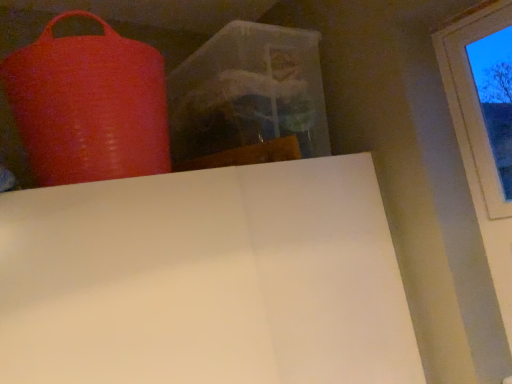
Question: From a real-world perspective, is rubberized red punching bag at upper left located higher than transparent glass window at upper right?

Choices:
 (A) yes
 (B) no

Answer: (A)

Question: Considering the relative sizes of rubberized red punching bag at upper left and transparent glass window at upper right in the image provided, is rubberized red punching bag at upper left smaller than transparent glass window at upper right?

Choices:
 (A) yes
 (B) no

Answer: (B)

Question: Is rubberized red punching bag at upper left facing towards transparent glass window at upper right?

Choices:
 (A) no
 (B) yes

Answer: (A)

Question: Does rubberized red punching bag at upper left have a greater width compared to transparent glass window at upper right?

Choices:
 (A) yes
 (B) no

Answer: (A)

Question: Is rubberized red punching bag at upper left directly adjacent to transparent glass window at upper right?

Choices:
 (A) no
 (B) yes

Answer: (A)

Question: From a real-world perspective, is rubberized red punching bag at upper left physically below transparent glass window at upper right?

Choices:
 (A) yes
 (B) no

Answer: (B)

Question: Does transparent glass window at upper right have a larger size compared to rubberized red punching bag at upper left?

Choices:
 (A) no
 (B) yes

Answer: (A)

Question: Is transparent glass window at upper right in front of rubberized red punching bag at upper left?

Choices:
 (A) no
 (B) yes

Answer: (A)

Question: From the image's perspective, is transparent glass window at upper right located above rubberized red punching bag at upper left?

Choices:
 (A) yes
 (B) no

Answer: (B)

Question: Is transparent glass window at upper right smaller than rubberized red punching bag at upper left?

Choices:
 (A) no
 (B) yes

Answer: (B)

Question: Is rubberized red punching bag at upper left at the back of transparent glass window at upper right?

Choices:
 (A) no
 (B) yes

Answer: (A)

Question: Would you say transparent glass window at upper right contains rubberized red punching bag at upper left?

Choices:
 (A) yes
 (B) no

Answer: (B)

Question: Considering the positions of rubberized red punching bag at upper left and transparent glass window at upper right in the image, is rubberized red punching bag at upper left wider or thinner than transparent glass window at upper right?

Choices:
 (A) thin
 (B) wide

Answer: (B)